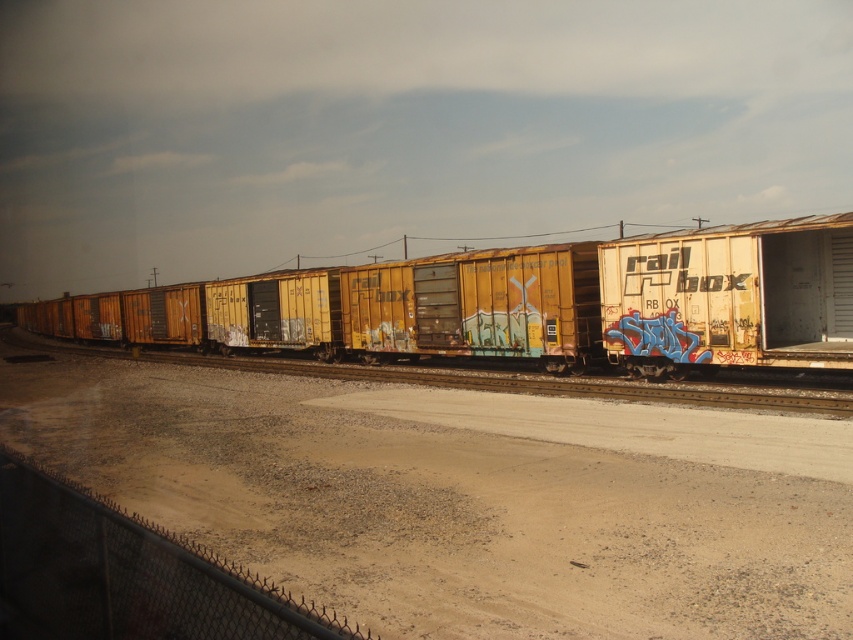
Question: Which object is farther from the camera taking this photo?

Choices:
 (A) yellow weathered boxcar at center
 (B) yellow matte train car at center
 (C) brown gravel dirt track at center

Answer: (A)

Question: Observing the image, what is the correct spatial positioning of brown gravel dirt track at center in reference to yellow matte train car at center?

Choices:
 (A) below
 (B) above

Answer: (A)

Question: Does brown gravel dirt track at center appear on the right side of yellow matte train car at center?

Choices:
 (A) no
 (B) yes

Answer: (B)

Question: Is brown gravel dirt track at center smaller than yellow weathered boxcar at center?

Choices:
 (A) no
 (B) yes

Answer: (B)

Question: Which point is farther from the camera taking this photo?

Choices:
 (A) (360, 488)
 (B) (775, 401)
 (C) (408, 342)

Answer: (C)

Question: Which point is farther from the camera taking this photo?

Choices:
 (A) (772, 419)
 (B) (798, 339)
 (C) (328, 376)

Answer: (C)